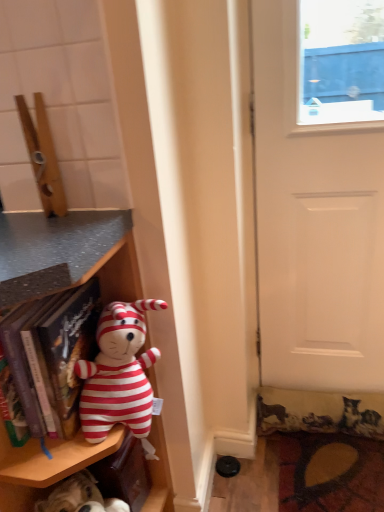
Question: From the image's perspective, is white matte door at right over striped fabric plush toy at left?

Choices:
 (A) yes
 (B) no

Answer: (A)

Question: Does white matte door at right have a lesser height compared to striped fabric plush toy at left?

Choices:
 (A) yes
 (B) no

Answer: (B)

Question: Is the depth of white matte door at right less than that of striped fabric plush toy at left?

Choices:
 (A) no
 (B) yes

Answer: (A)

Question: From a real-world perspective, is white matte door at right positioned over striped fabric plush toy at left based on gravity?

Choices:
 (A) yes
 (B) no

Answer: (A)

Question: Is white matte door at right wider than striped fabric plush toy at left?

Choices:
 (A) yes
 (B) no

Answer: (B)

Question: Looking at the image, does fluffy carpet at lower right seem bigger or smaller compared to striped fabric plush toy at left?

Choices:
 (A) big
 (B) small

Answer: (B)

Question: From their relative heights in the image, would you say fluffy carpet at lower right is taller or shorter than striped fabric plush toy at left?

Choices:
 (A) short
 (B) tall

Answer: (A)

Question: Considering the relative positions of fluffy carpet at lower right and striped fabric plush toy at left in the image provided, is fluffy carpet at lower right to the left or to the right of striped fabric plush toy at left?

Choices:
 (A) left
 (B) right

Answer: (B)

Question: Is fluffy carpet at lower right in front of or behind striped fabric plush toy at left in the image?

Choices:
 (A) front
 (B) behind

Answer: (B)

Question: Is striped fabric plush toy at left inside the boundaries of matte plastic shelf at left, or outside?

Choices:
 (A) inside
 (B) outside

Answer: (A)

Question: Is point (105, 404) closer or farther from the camera than point (87, 446)?

Choices:
 (A) closer
 (B) farther

Answer: (B)

Question: Based on their positions, is striped fabric plush toy at left located to the left or right of matte plastic shelf at left?

Choices:
 (A) right
 (B) left

Answer: (A)

Question: Looking at the image, does striped fabric plush toy at left seem bigger or smaller compared to matte plastic shelf at left?

Choices:
 (A) small
 (B) big

Answer: (A)

Question: Which is correct: matte plastic shelf at left is inside striped fabric plush toy at left, or outside of it?

Choices:
 (A) outside
 (B) inside

Answer: (A)

Question: Considering the relative positions of matte plastic shelf at left and striped fabric plush toy at left in the image provided, is matte plastic shelf at left to the left or to the right of striped fabric plush toy at left?

Choices:
 (A) right
 (B) left

Answer: (B)